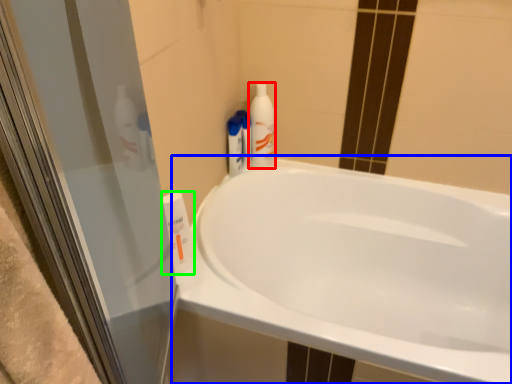
Question: Which object is positioned closest to cleaning product (highlighted by a red box)? Select from bathtub (highlighted by a blue box) and cleaning product (highlighted by a green box).

Choices:
 (A) bathtub
 (B) cleaning product

Answer: (A)